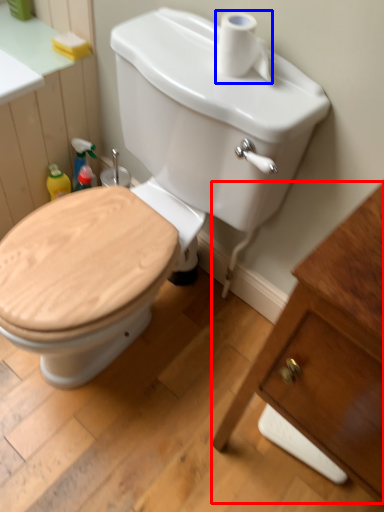
Question: Among these objects, which one is nearest to the camera, porcelain (highlighted by a red box) or toilet paper (highlighted by a blue box)?

Choices:
 (A) porcelain
 (B) toilet paper

Answer: (A)